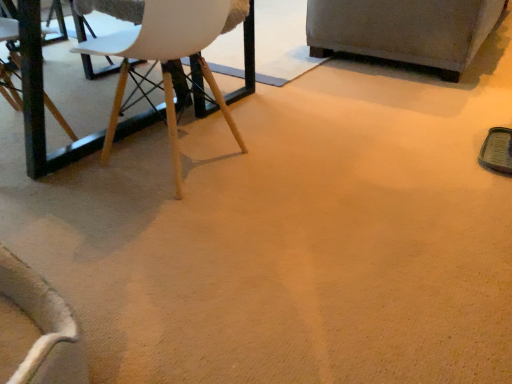
Question: From a real-world perspective, is velvet gray armchair at upper right positioned above or below white matte chair at upper left?

Choices:
 (A) below
 (B) above

Answer: (A)

Question: In terms of width, does velvet gray armchair at upper right look wider or thinner when compared to white matte chair at upper left?

Choices:
 (A) wide
 (B) thin

Answer: (A)

Question: Considering the positions of point (372, 56) and point (212, 3), is point (372, 56) closer or farther from the camera than point (212, 3)?

Choices:
 (A) farther
 (B) closer

Answer: (A)

Question: From the image's perspective, relative to velvet gray armchair at upper right, is white matte chair at upper left above or below?

Choices:
 (A) above
 (B) below

Answer: (B)

Question: Considering the positions of point (215, 23) and point (470, 4), is point (215, 23) closer or farther from the camera than point (470, 4)?

Choices:
 (A) closer
 (B) farther

Answer: (A)

Question: Considering the positions of white matte chair at upper left and velvet gray armchair at upper right in the image, is white matte chair at upper left bigger or smaller than velvet gray armchair at upper right?

Choices:
 (A) big
 (B) small

Answer: (B)

Question: From a real-world perspective, is white matte chair at upper left positioned above or below velvet gray armchair at upper right?

Choices:
 (A) above
 (B) below

Answer: (A)